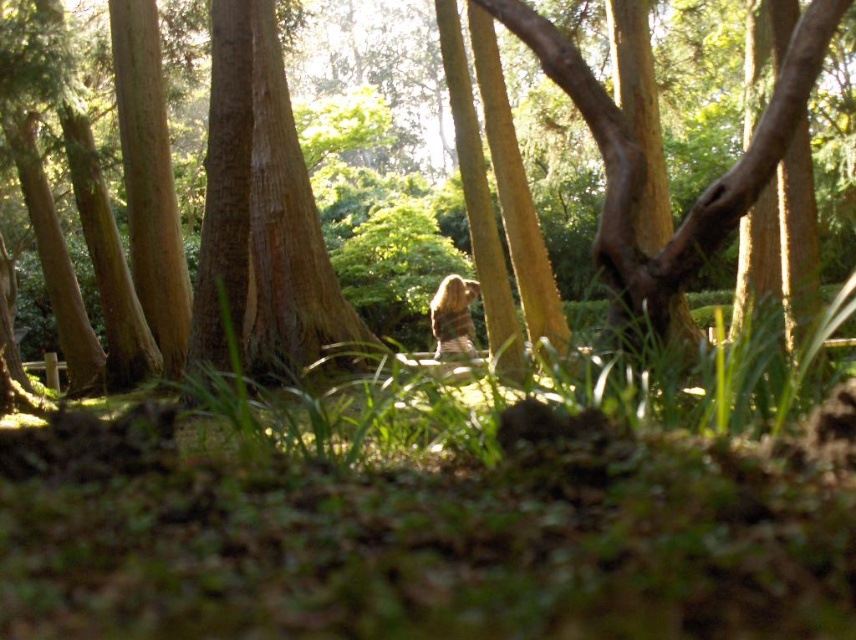
You are a photographer positioned at the camera location in the forest scene. You want to take a photo where both the point at coordinates (591, 97) and the point at (450, 328) are in focus. Which point should you focus on to ensure both are sharp?

You should focus on the point at coordinates (450, 328) because it is farther from the camera, and focusing on the farther point will keep both points in focus due to the depth of field extending backward and forward from that point.

You are a hiker navigating through the forest. You see two points marked in the image. Which point is closer to you, the point at coordinates (792,595) or the point at (438,285)?

Point (792,595) is in front of point (438,285), so the point at coordinates (792,595) is closer to you.

You are a photographer standing in the forest and see the smooth brown tree trunk at center and the brown furry bear at center. Which object is positioned higher in the scene?

The smooth brown tree trunk at center is positioned above the brown furry bear at center, so it is higher in the scene.